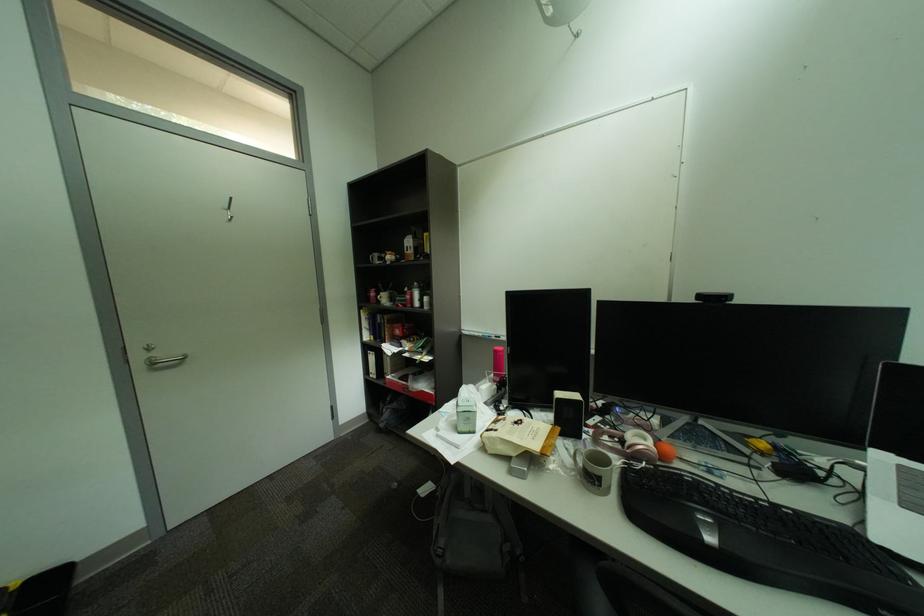
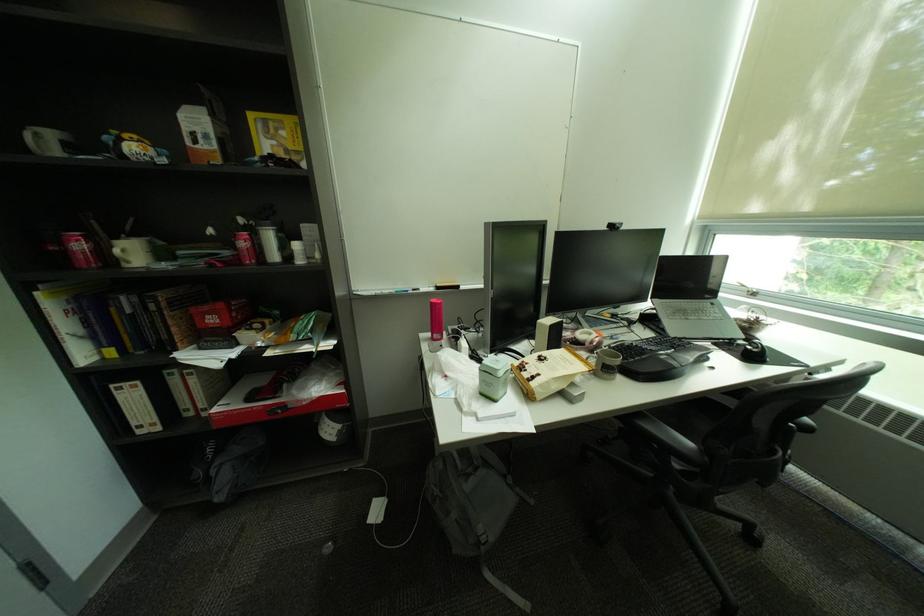
The point at [390,298] is marked in the first image. Where is the corresponding point in the second image?

(128, 252)